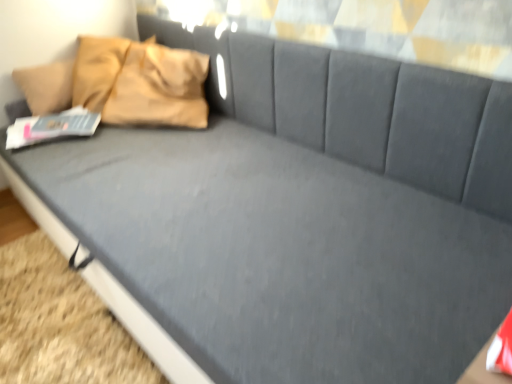
The image size is (512, 384). What do you see at coordinates (51, 127) in the screenshot?
I see `white paper at left` at bounding box center [51, 127].

The width and height of the screenshot is (512, 384). Identify the location of white paper at left. (51, 127).

Where is `white paper at left`? This screenshot has height=384, width=512. white paper at left is located at coordinates (51, 127).